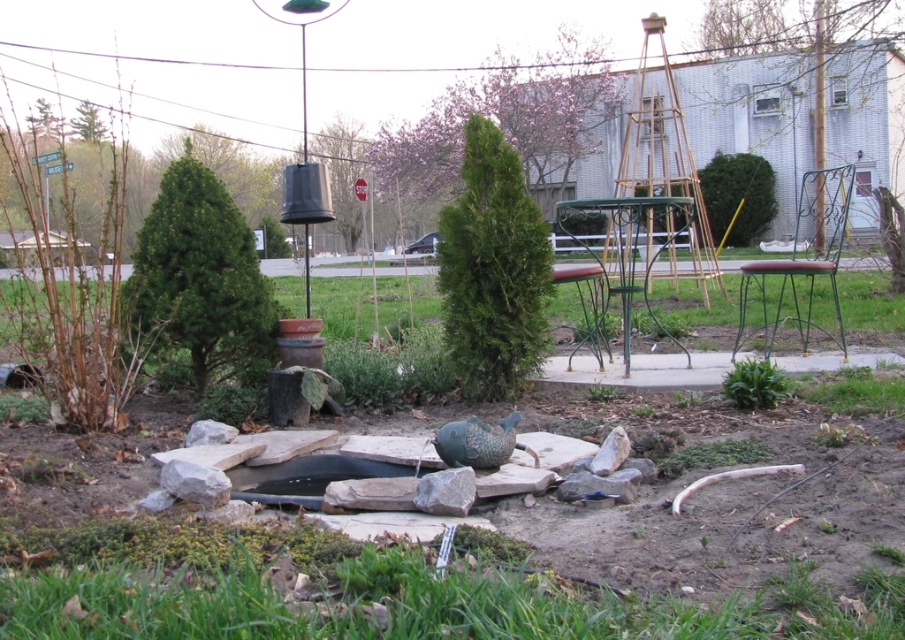
Question: Is green textured evergreen tree at center behind brown leather stool at right?

Choices:
 (A) yes
 (B) no

Answer: (B)

Question: Can you confirm if green textured evergreen tree at center is bigger than green textured tree at left?

Choices:
 (A) yes
 (B) no

Answer: (A)

Question: Which of the following is the farthest from the observer?

Choices:
 (A) green textured tree at left
 (B) green textured evergreen tree at center

Answer: (A)

Question: Considering the real-world distances, which object is closest to the green grass at lower left?

Choices:
 (A) green textured evergreen tree at center
 (B) brown leather stool at right
 (C) green textured tree at left
 (D) green leafy tree at right

Answer: (A)

Question: Which point is farther to the camera?

Choices:
 (A) green leafy tree at right
 (B) green grass at lower left

Answer: (A)

Question: Is green grass at lower left below brown leather stool at right?

Choices:
 (A) yes
 (B) no

Answer: (A)